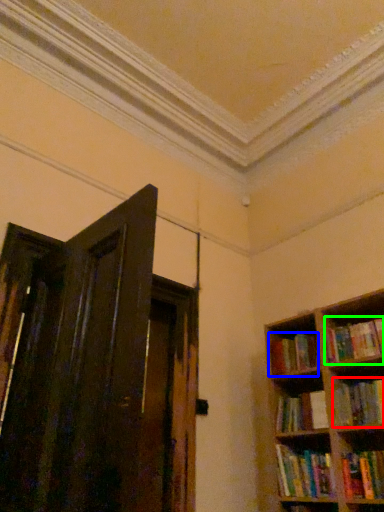
Question: Based on their relative distances, which object is farther from book (highlighted by a red box)? Choose from book (highlighted by a blue box) and book (highlighted by a green box).

Choices:
 (A) book
 (B) book

Answer: (A)